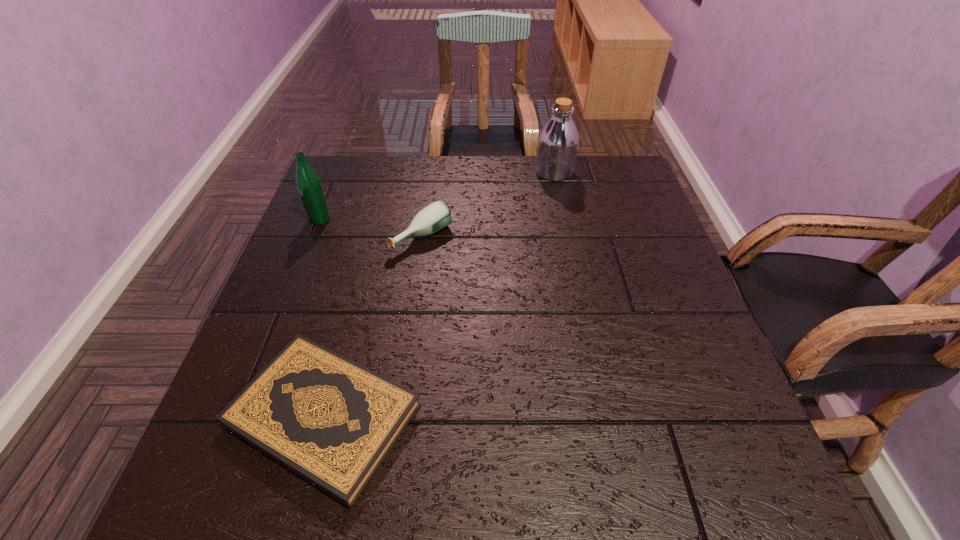
You are a GUI agent. You are given a task and a screenshot of the screen. Output one action in this format:
    pyautogui.click(x=<x>, y=<y>)
    Task: Click on the unoccupied area between the nearest object and the farthest object
    The height and width of the screenshot is (540, 960).
    Given the screenshot: What is the action you would take?
    pyautogui.click(x=439, y=294)

This screenshot has height=540, width=960. Find the location of `free space between the rightmost object and the leftmost bottle`. free space between the rightmost object and the leftmost bottle is located at coordinates (437, 195).

Locate which object ranks second in proximity to the nearest object. Please provide its 2D coordinates. Your answer should be formatted as a tuple, i.e. [(x, y)], where the tuple contains the x and y coordinates of a point satisfying the conditions above.

[(308, 183)]

Identify the location of the third closest object to the farthest bottle. (331, 421).

This screenshot has width=960, height=540. What are the coordinates of `bottle object that ranks as the closest to the leftmost bottle` in the screenshot? It's located at point(437,215).

Identify which bottle is the third nearest to the nearest object. Please provide its 2D coordinates. Your answer should be formatted as a tuple, i.e. [(x, y)], where the tuple contains the x and y coordinates of a point satisfying the conditions above.

[(558, 140)]

Where is `vacant space that satisfies the following two spatial constraints: 1. on the front side of the leftmost bottle; 2. on the left side of the shortest bottle`? The height and width of the screenshot is (540, 960). vacant space that satisfies the following two spatial constraints: 1. on the front side of the leftmost bottle; 2. on the left side of the shortest bottle is located at coordinates (313, 237).

Image resolution: width=960 pixels, height=540 pixels. I want to click on free space that satisfies the following two spatial constraints: 1. on the back side of the nearest object; 2. on the left side of the shortest bottle, so click(x=371, y=237).